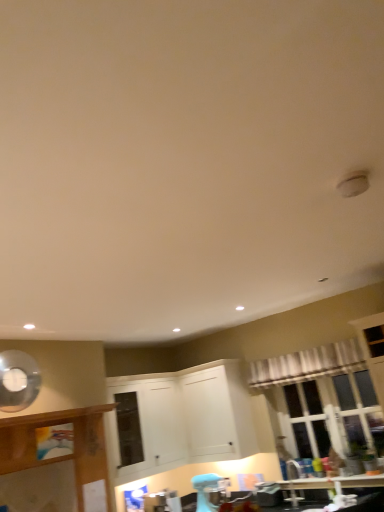
Question: Could you tell me if white matte cabinet at center, arranged as the second cabinetry when viewed from the left, is facing white sheer curtain at upper right?

Choices:
 (A) no
 (B) yes

Answer: (B)

Question: Are white matte cabinet at center, which is the 2th cabinetry from right to left, and white sheer curtain at upper right located far from each other?

Choices:
 (A) yes
 (B) no

Answer: (A)

Question: Is white matte cabinet at center, arranged as the second cabinetry when viewed from the left, facing away from white sheer curtain at upper right?

Choices:
 (A) yes
 (B) no

Answer: (B)

Question: Is white matte cabinet at center, which is the 2th cabinetry from right to left, at the right side of white sheer curtain at upper right?

Choices:
 (A) no
 (B) yes

Answer: (A)

Question: Is white matte cabinet at center, arranged as the second cabinetry when viewed from the left, bigger than white sheer curtain at upper right?

Choices:
 (A) no
 (B) yes

Answer: (B)

Question: From a real-world perspective, relative to wooden cabinet at left, the 3th cabinetry when ordered from right to left, is white sheer curtain at upper right vertically above or below?

Choices:
 (A) above
 (B) below

Answer: (A)

Question: From the image's perspective, is white sheer curtain at upper right above or below wooden cabinet at left, the 1th cabinetry from the left?

Choices:
 (A) below
 (B) above

Answer: (B)

Question: Visually, is white sheer curtain at upper right positioned to the left or to the right of wooden cabinet at left, the 1th cabinetry from the left?

Choices:
 (A) left
 (B) right

Answer: (B)

Question: Relative to wooden cabinet at left, the 1th cabinetry from the left, is white sheer curtain at upper right in front or behind?

Choices:
 (A) behind
 (B) front

Answer: (A)

Question: Is wooden cabinet at left, the 3th cabinetry when ordered from right to left, to the left or to the right of white matte cabinet at center, which is the 2th cabinetry from right to left, in the image?

Choices:
 (A) left
 (B) right

Answer: (A)

Question: Considering the positions of wooden cabinet at left, the 1th cabinetry from the left, and white matte cabinet at center, which is the 2th cabinetry from right to left, in the image, is wooden cabinet at left, the 1th cabinetry from the left, bigger or smaller than white matte cabinet at center, which is the 2th cabinetry from right to left,?

Choices:
 (A) small
 (B) big

Answer: (A)

Question: Does point (74, 464) appear closer or farther from the camera than point (180, 437)?

Choices:
 (A) farther
 (B) closer

Answer: (B)

Question: Looking at their shapes, would you say wooden cabinet at left, the 3th cabinetry when ordered from right to left, is wider or thinner than white matte cabinet at center, arranged as the second cabinetry when viewed from the left?

Choices:
 (A) wide
 (B) thin

Answer: (B)

Question: From their relative heights in the image, would you say white matte cabinet at center, arranged as the second cabinetry when viewed from the left, is taller or shorter than white sheer curtain at upper right?

Choices:
 (A) tall
 (B) short

Answer: (A)

Question: From the image's perspective, is white matte cabinet at center, which is the 2th cabinetry from right to left, located above or below white sheer curtain at upper right?

Choices:
 (A) above
 (B) below

Answer: (B)